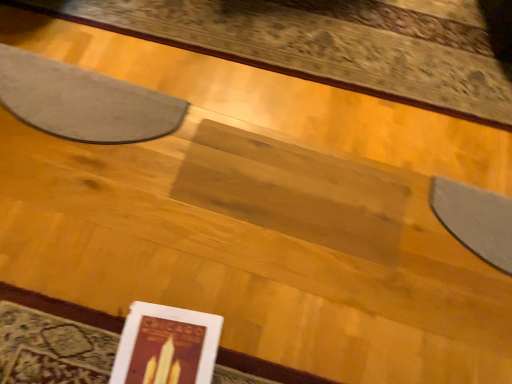
The image size is (512, 384). I want to click on vacant area that lies to the right of matte paper book at lower left, so click(x=270, y=344).